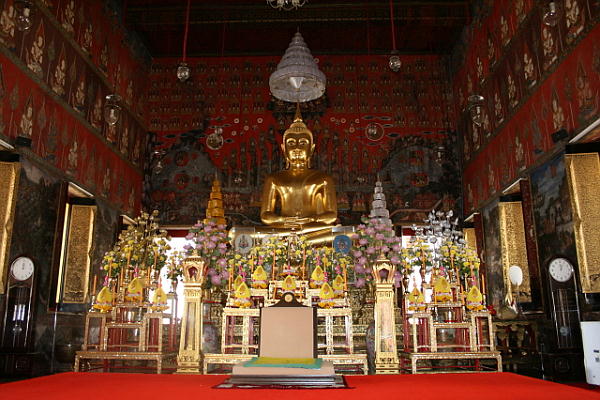
Where is `clock`? The height and width of the screenshot is (400, 600). clock is located at coordinates (22, 266).